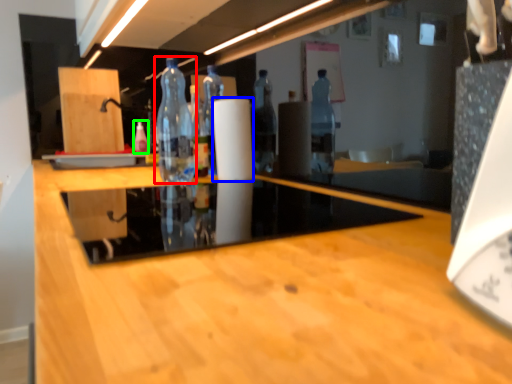
Question: Which object is the closest to the bottle (highlighted by a red box)? Choose among these: paper towel (highlighted by a blue box) or bottle (highlighted by a green box).

Choices:
 (A) paper towel
 (B) bottle

Answer: (A)